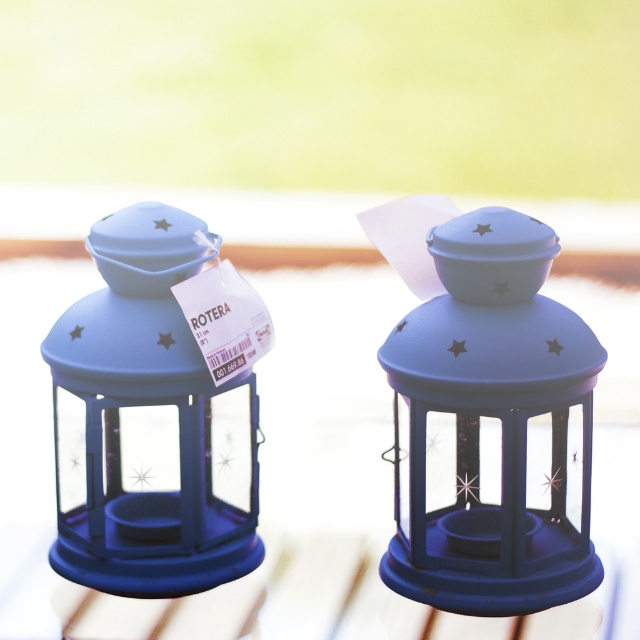
Question: Can you confirm if matte blue lantern at center is bigger than matte blue lantern at left?

Choices:
 (A) yes
 (B) no

Answer: (B)

Question: Is matte blue lantern at center to the left of matte blue lantern at left from the viewer's perspective?

Choices:
 (A) yes
 (B) no

Answer: (B)

Question: Among these objects, which one is farthest from the camera?

Choices:
 (A) matte blue lantern at center
 (B) matte blue lantern at left

Answer: (B)

Question: Can you confirm if matte blue lantern at center is thinner than matte blue lantern at left?

Choices:
 (A) yes
 (B) no

Answer: (A)

Question: Which of the following is the closest to the observer?

Choices:
 (A) matte blue lantern at left
 (B) matte blue lantern at center

Answer: (B)